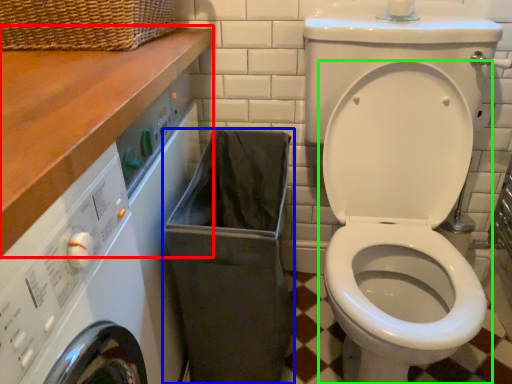
Question: Which is farther away from counter top (highlighted by a red box)? laundry basket (highlighted by a blue box) or toilet (highlighted by a green box)?

Choices:
 (A) laundry basket
 (B) toilet

Answer: (B)